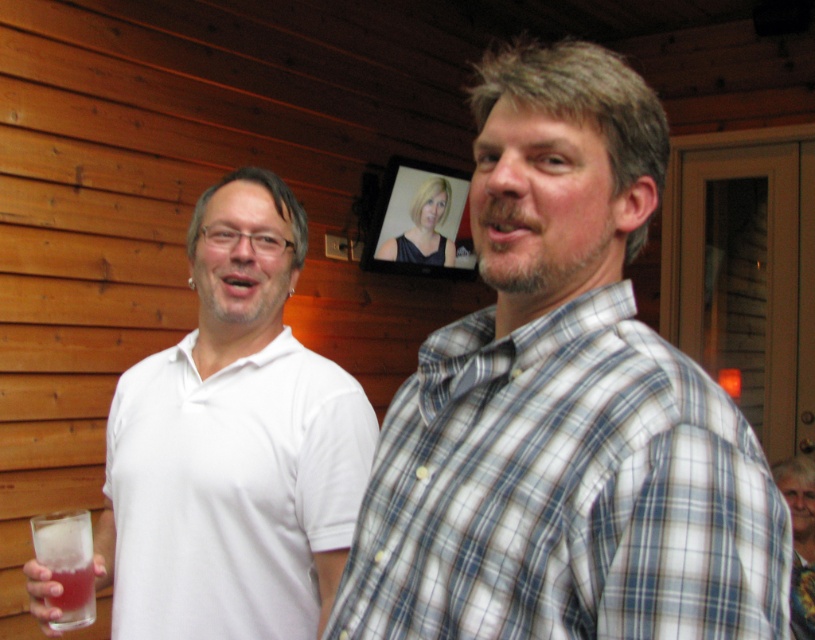
Looking at this image, which of these two, blue-gray plaid shirt at right or translucent glass at lower left, stands taller?

Standing taller between the two is blue-gray plaid shirt at right.

In the scene shown: Between blue-gray plaid shirt at right and translucent glass at lower left, which one is positioned lower?

Positioned lower is translucent glass at lower left.

Where is `blue-gray plaid shirt at right`? Image resolution: width=815 pixels, height=640 pixels. blue-gray plaid shirt at right is located at coordinates (564, 492).

Locate an element on the screen. blue-gray plaid shirt at right is located at coordinates (564, 492).

Is blue-gray plaid shirt at right below white matte shirt at left?

No, blue-gray plaid shirt at right is not below white matte shirt at left.

Who is more forward, (x=526, y=397) or (x=249, y=502)?

Point (x=526, y=397)

At what (x,y) coordinates should I click in order to perform the action: click on blue-gray plaid shirt at right. Please return your answer as a coordinate pair (x, y). This screenshot has width=815, height=640. Looking at the image, I should click on (564, 492).

Does white matte shirt at left have a greater width compared to translucent glass at lower left?

Yes.

Image resolution: width=815 pixels, height=640 pixels. What are the coordinates of `white matte shirt at left` in the screenshot? It's located at (232, 445).

Which is in front, point (274, 477) or point (71, 577)?

Point (71, 577) is in front.

Find the location of a particular element. This screenshot has width=815, height=640. white matte shirt at left is located at coordinates (232, 445).